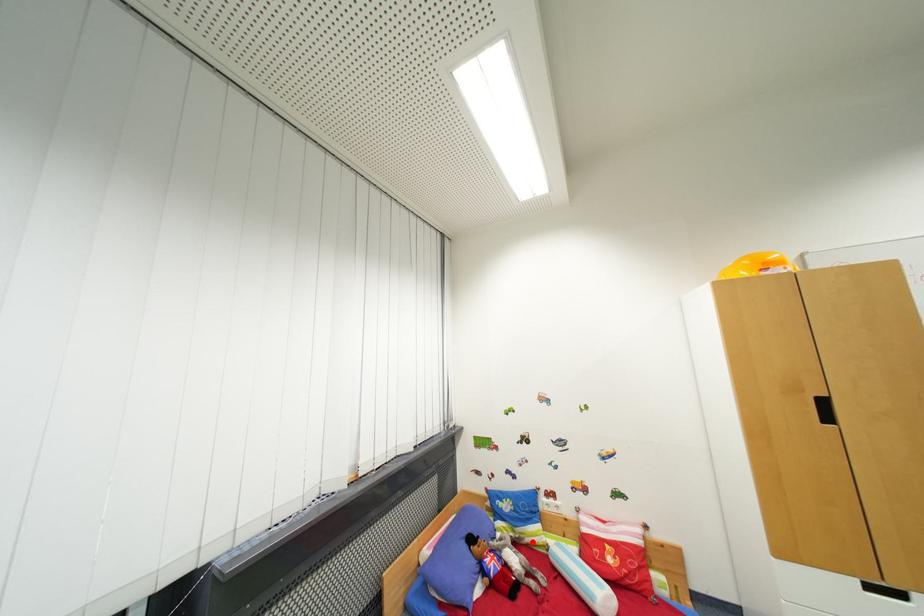
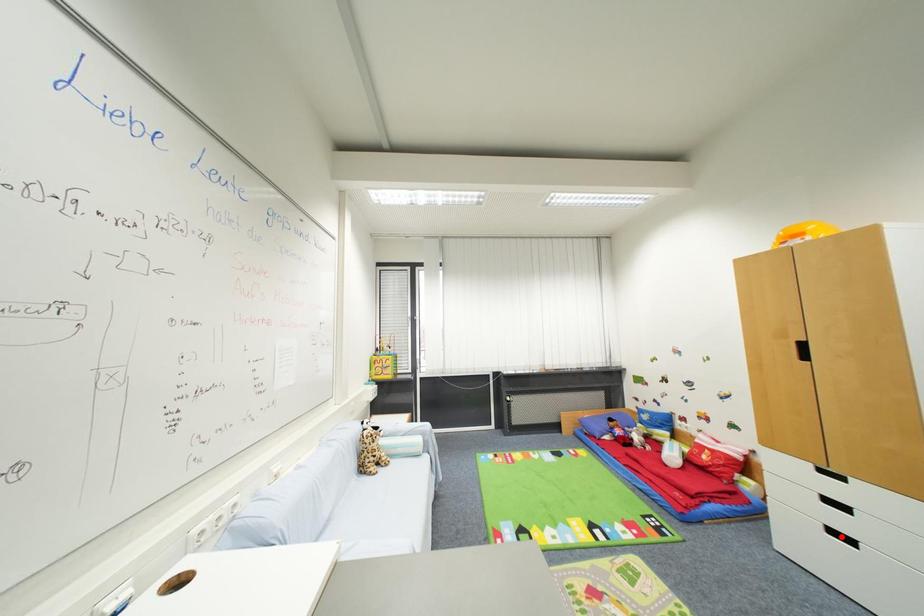
I am providing you with two images of the same scene from different viewpoints. A red point is marked on the first image and another point is marked on the second image. Is the red point in image1 aligned with the point shown in image2?

No